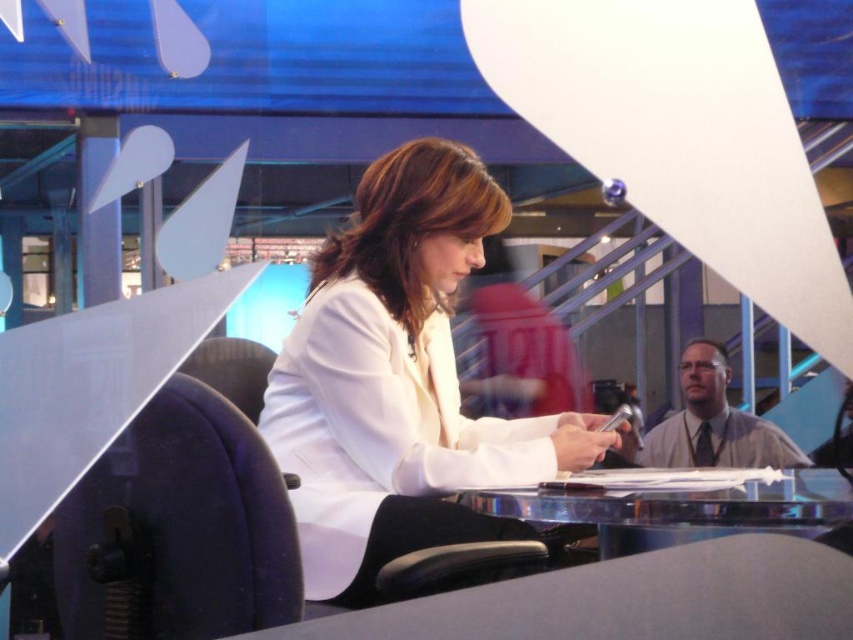
Between point (164, 488) and point (631, 552), which one is positioned in front?

Positioned in front is point (164, 488).

Between black fabric swivel chair at left and clear glass table at center, which one appears on the left side from the viewer's perspective?

From the viewer's perspective, black fabric swivel chair at left appears more on the left side.

Between point (260, 509) and point (641, 492), which one is positioned behind?

Positioned behind is point (641, 492).

This screenshot has width=853, height=640. What are the coordinates of `black fabric swivel chair at left` in the screenshot? It's located at (178, 529).

Can you confirm if white matte jacket at center is positioned to the left of clear glass table at center?

Correct, you'll find white matte jacket at center to the left of clear glass table at center.

Between point (381, 196) and point (712, 508), which one is positioned in front?

Point (712, 508) is in front.

This screenshot has width=853, height=640. Identify the location of white matte jacket at center. (399, 381).

Is point (358, 218) behind point (247, 420)?

Yes.

Which is above, white matte jacket at center or black fabric swivel chair at left?

white matte jacket at center is above.

Which is behind, point (335, 492) or point (126, 449)?

The point (335, 492) is behind.

The width and height of the screenshot is (853, 640). What are the coordinates of `white matte jacket at center` in the screenshot? It's located at (399, 381).